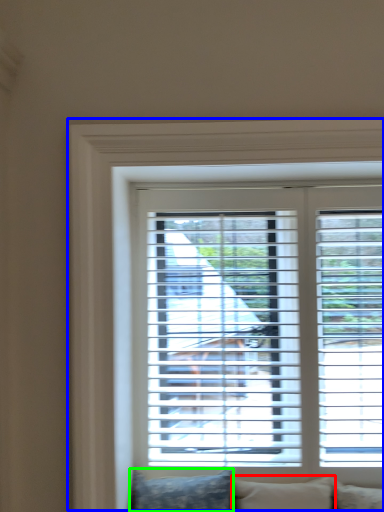
Question: Considering the real-world distances, which object is closest to pillow (highlighted by a red box)? window (highlighted by a blue box) or pillow (highlighted by a green box).

Choices:
 (A) window
 (B) pillow

Answer: (B)